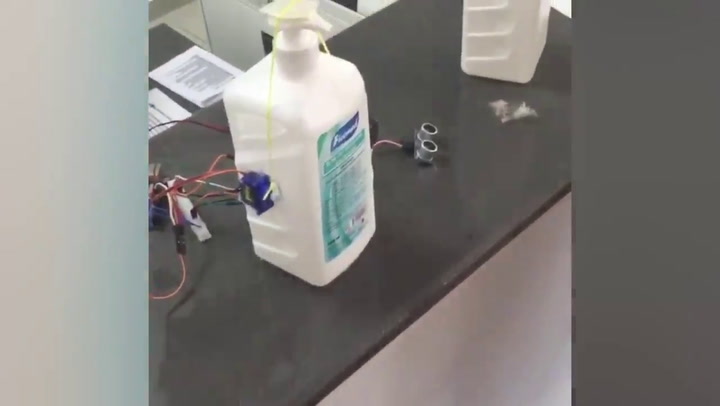
Locate an element on the screen. wires is located at coordinates (207, 174), (181, 257), (391, 140).